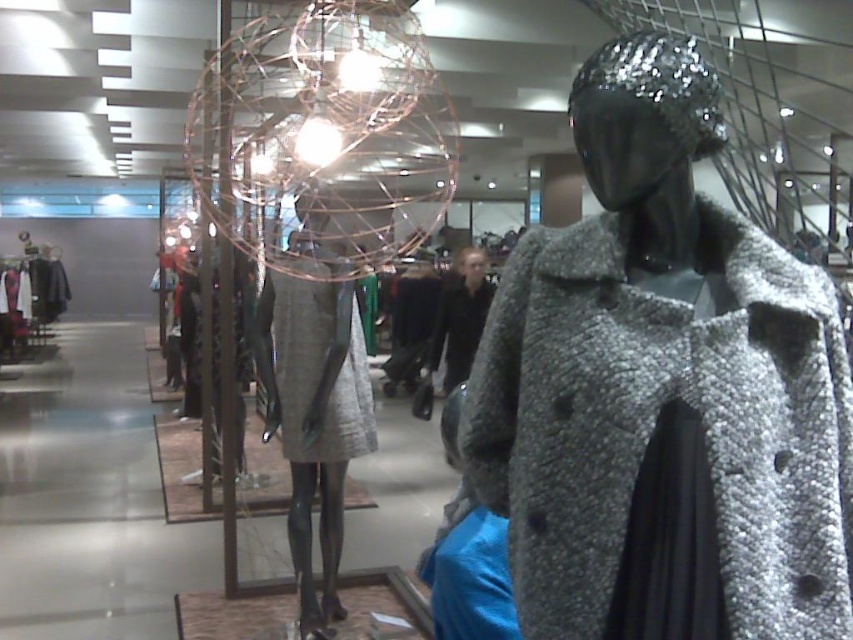
You are a customer in the store and want to know which item takes up more space on the display rack. Which one is larger between the sparkly silver coat at center and the matte gray skirt at center?

The matte gray skirt at center is larger than the sparkly silver coat at center, so it takes up more space on the display rack.

Looking at this image, you are a customer in the store and want to know which coat is shorter between the sparkly silver coat at center and the gray woolen coat at center. Can you tell me?

The sparkly silver coat at center is not as tall as the gray woolen coat at center, so the sparkly silver coat at center is shorter.

You are a customer in the store and want to see both the sparkly silver coat at center and the matte gray skirt at center. Which one is located higher up on the display rack?

The sparkly silver coat at center is above the matte gray skirt at center, so it is located higher up on the display rack.